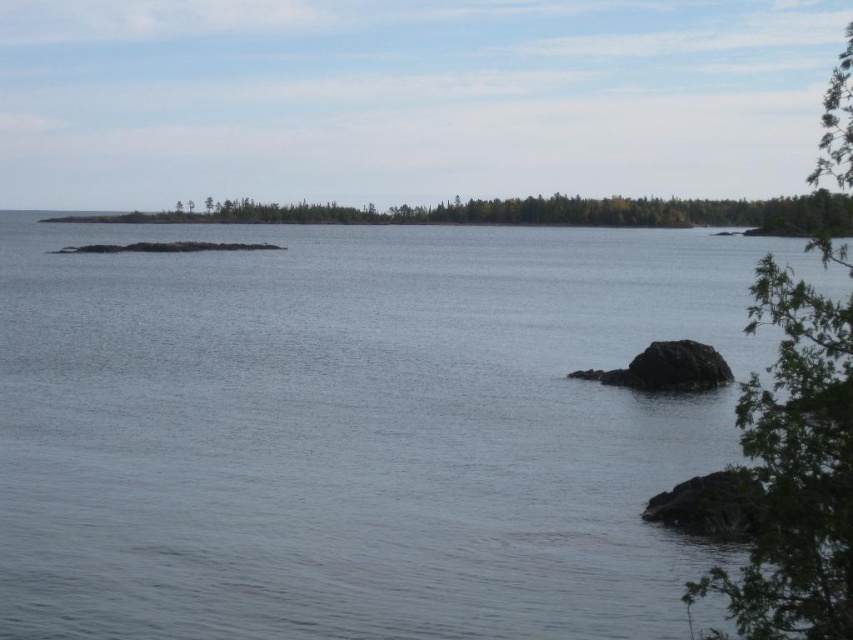
Question: Which point is closer to the camera?

Choices:
 (A) green leafy tree at right
 (B) green matte forest at center
 (C) clear water at center

Answer: (A)

Question: Which object is farther from the camera taking this photo?

Choices:
 (A) green leafy tree at right
 (B) clear water at center
 (C) green matte forest at center

Answer: (C)

Question: Can you confirm if clear water at center is positioned above green leafy tree at right?

Choices:
 (A) yes
 (B) no

Answer: (B)

Question: Does green leafy tree at right have a greater width compared to green matte forest at center?

Choices:
 (A) yes
 (B) no

Answer: (B)

Question: Which object is farther from the camera taking this photo?

Choices:
 (A) green matte forest at center
 (B) green leafy tree at right
 (C) clear water at center

Answer: (A)

Question: Can you confirm if clear water at center is positioned above green matte forest at center?

Choices:
 (A) no
 (B) yes

Answer: (A)